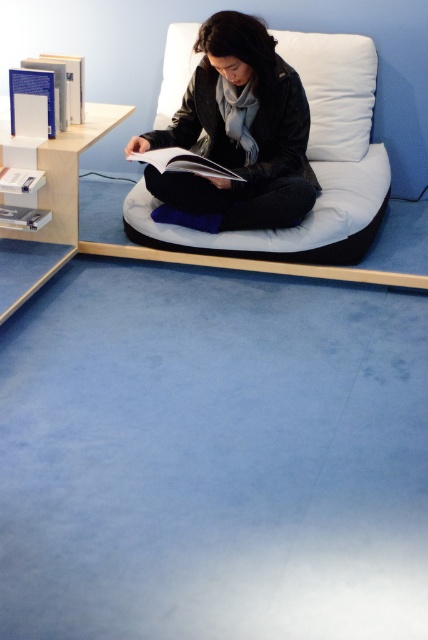
Question: Is white fabric bean bag chair at center thinner than white paper book at center?

Choices:
 (A) yes
 (B) no

Answer: (B)

Question: Does blue hardcover book at upper left appear over white paper book at center?

Choices:
 (A) no
 (B) yes

Answer: (B)

Question: Among these points, which one is nearest to the camera?

Choices:
 (A) (26, 189)
 (B) (368, 60)
 (C) (30, 209)
 (D) (374, 184)

Answer: (A)

Question: Among these objects, which one is nearest to the camera?

Choices:
 (A) white soft cushion at center
 (B) white matte book at left
 (C) white fabric bean bag chair at center

Answer: (B)

Question: Considering the real-world distances, which object is closest to the white paper book at center?

Choices:
 (A) white soft cushion at center
 (B) white fabric bean bag chair at center
 (C) blue hardcover book at upper left

Answer: (B)

Question: Does white fabric bean bag chair at center appear on the right side of white matte book at left?

Choices:
 (A) no
 (B) yes

Answer: (B)